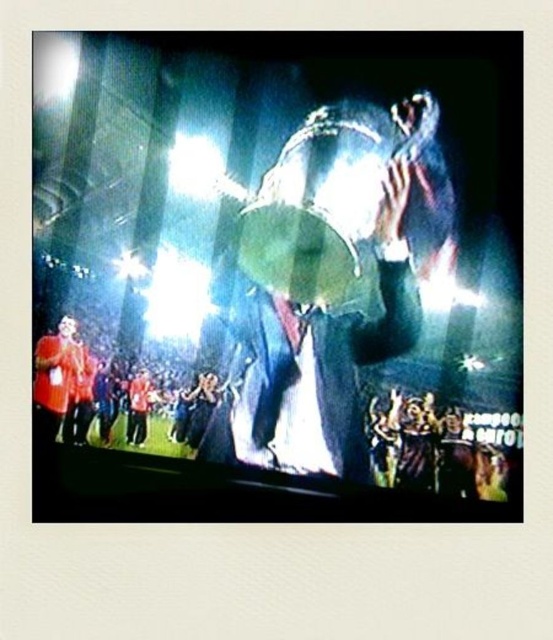
Can you confirm if metallic trophy at center is wider than shiny silver drum at center?

In fact, metallic trophy at center might be narrower than shiny silver drum at center.

Where is `metallic trophy at center`? The height and width of the screenshot is (640, 553). metallic trophy at center is located at coordinates (276, 275).

I want to click on metallic trophy at center, so click(276, 275).